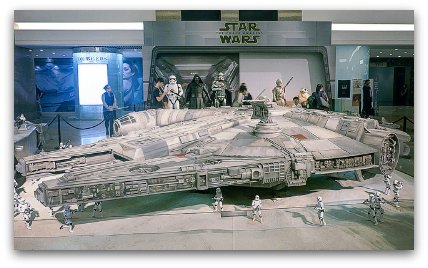
At what (x,y) coordinates should I click in order to perform the action: click on advertisement poster. Please return your answer as a coordinate pair (x, y). The width and height of the screenshot is (428, 268). Looking at the image, I should click on (130, 76).